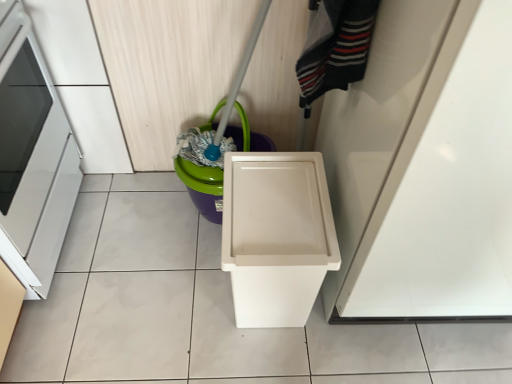
Question: From a real-world perspective, is matte green plastic bucket at center on white glossy oven at left?

Choices:
 (A) yes
 (B) no

Answer: (B)

Question: Does matte green plastic bucket at center lie behind white glossy oven at left?

Choices:
 (A) no
 (B) yes

Answer: (B)

Question: Does matte green plastic bucket at center have a greater height compared to white glossy oven at left?

Choices:
 (A) no
 (B) yes

Answer: (A)

Question: Is matte green plastic bucket at center touching white glossy oven at left?

Choices:
 (A) no
 (B) yes

Answer: (A)

Question: Does matte green plastic bucket at center have a greater width compared to white glossy oven at left?

Choices:
 (A) no
 (B) yes

Answer: (A)

Question: Is matte green plastic bucket at center looking in the opposite direction of white glossy oven at left?

Choices:
 (A) yes
 (B) no

Answer: (B)

Question: Does white plastic waste container at center have a lesser width compared to striped wool sweater at upper right?

Choices:
 (A) yes
 (B) no

Answer: (B)

Question: From the image's perspective, is white plastic waste container at center over striped wool sweater at upper right?

Choices:
 (A) yes
 (B) no

Answer: (B)

Question: Considering the relative positions of white plastic waste container at center and striped wool sweater at upper right in the image provided, is white plastic waste container at center behind striped wool sweater at upper right?

Choices:
 (A) yes
 (B) no

Answer: (A)

Question: Can you confirm if white plastic waste container at center is wider than striped wool sweater at upper right?

Choices:
 (A) yes
 (B) no

Answer: (A)

Question: From a real-world perspective, is white plastic waste container at center on top of striped wool sweater at upper right?

Choices:
 (A) yes
 (B) no

Answer: (B)

Question: Could striped wool sweater at upper right be considered to be inside white plastic waste container at center?

Choices:
 (A) no
 (B) yes

Answer: (A)

Question: Considering the relative sizes of white plastic waste container at center and matte green plastic bucket at center in the image provided, is white plastic waste container at center bigger than matte green plastic bucket at center?

Choices:
 (A) yes
 (B) no

Answer: (A)